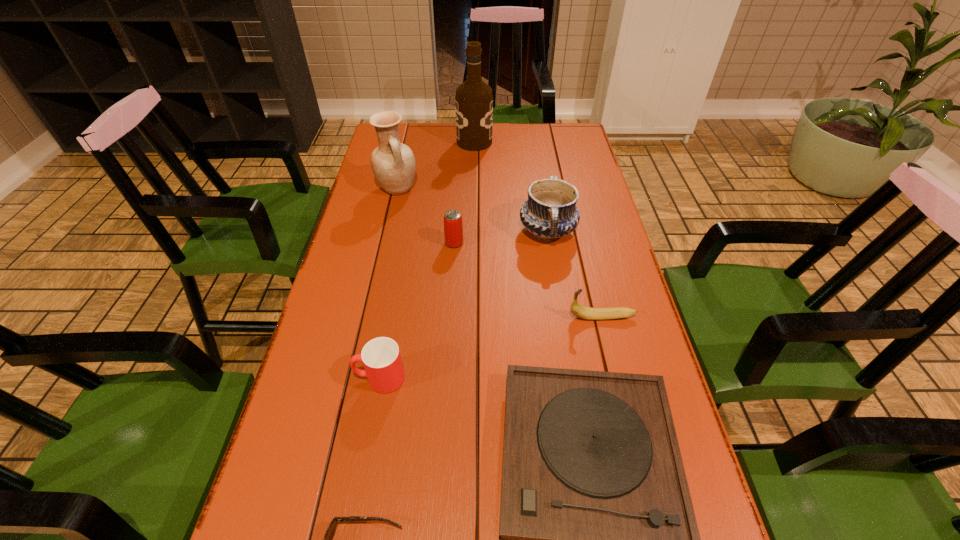
Find the location of a particular element. the tallest object is located at coordinates (474, 101).

Where is `the farthest object`? This screenshot has height=540, width=960. the farthest object is located at coordinates (474, 101).

Locate an element on the screen. This screenshot has height=540, width=960. the seventh nearest object is located at coordinates (393, 163).

In order to click on the taller pottery in this screenshot , I will do `click(393, 163)`.

Where is `the sixth shortest object`? Image resolution: width=960 pixels, height=540 pixels. the sixth shortest object is located at coordinates pos(550,212).

Image resolution: width=960 pixels, height=540 pixels. Find the location of `the shorter pottery`. the shorter pottery is located at coordinates (550, 212).

This screenshot has width=960, height=540. In order to click on beer can in this screenshot , I will do `click(453, 227)`.

Locate an element on the screen. This screenshot has width=960, height=540. the fourth nearest object is located at coordinates (587, 313).

Where is `cup`? The width and height of the screenshot is (960, 540). cup is located at coordinates (381, 358).

In order to click on vacant space located on the label of the farthest object in this screenshot , I will do `click(540, 142)`.